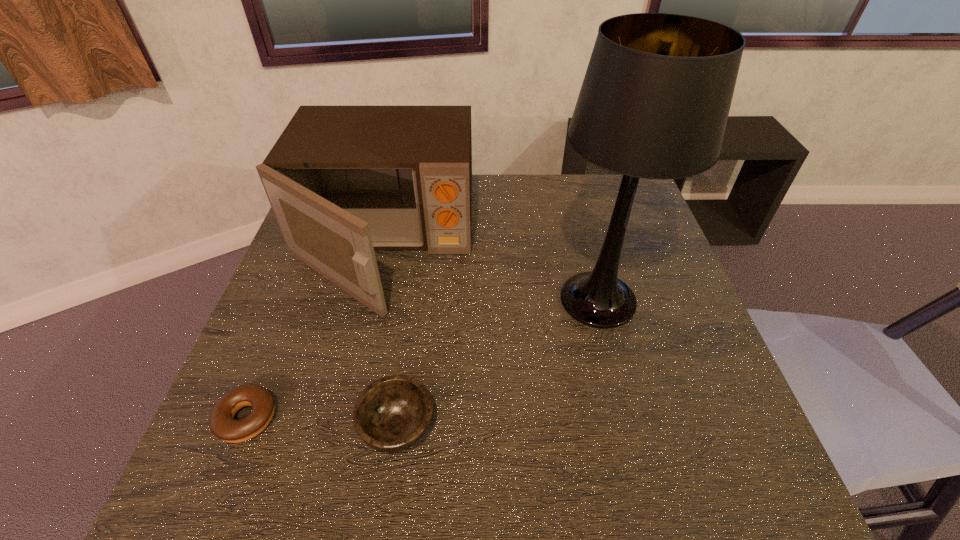
Where is `the closest object to the doughnut`? Image resolution: width=960 pixels, height=540 pixels. the closest object to the doughnut is located at coordinates (393, 413).

Identify the location of vacant space that satisfies the following two spatial constraints: 1. with the door open on the front of the bowl; 2. on the right side of the microwave oven. This screenshot has height=540, width=960. (340, 427).

The height and width of the screenshot is (540, 960). I want to click on free region that satisfies the following two spatial constraints: 1. with the door open on the front of the microwave oven; 2. on the left side of the bowl, so click(340, 427).

I want to click on vacant area in the image that satisfies the following two spatial constraints: 1. with the door open on the front of the third tallest object; 2. on the right side of the microwave oven, so click(x=340, y=427).

Where is `vacant space that satisfies the following two spatial constraints: 1. with the door open on the front of the rightmost object; 2. on the left side of the third shortest object`? vacant space that satisfies the following two spatial constraints: 1. with the door open on the front of the rightmost object; 2. on the left side of the third shortest object is located at coordinates (371, 300).